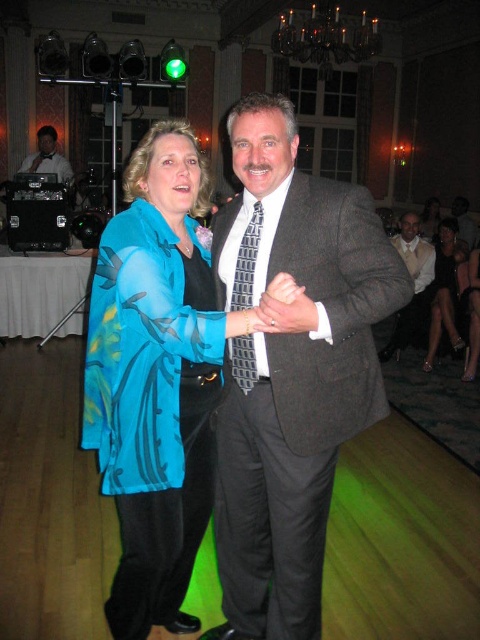
You are standing at the entrance of the hall and want to take a photo that includes both the point at coordinates point [256,358] and the point at coordinates point [459,236]. Based on their positions, which point is closer to the camera so that it will appear larger in the photo?

Point [256,358] is closer to the camera than point [459,236], so it will appear larger in the photo.

You are standing at the entrance of the event hall and notice the blue silk blouse at center. Can you determine if the blouse is positioned closer to the left or right side of the room based on its coordinates?

The blue silk blouse at center is located at point 0.594 on the x and y axis, which places it closer to the right side of the room.